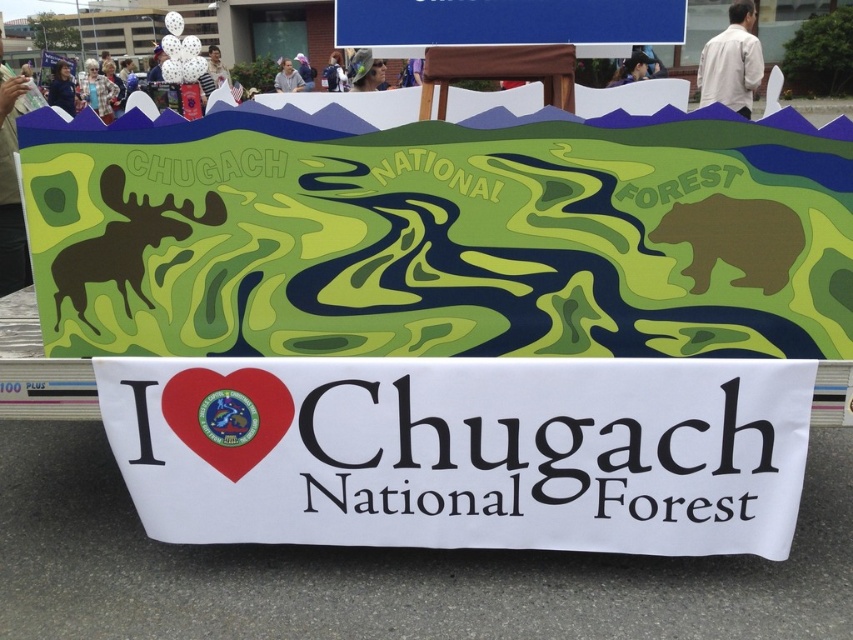
Question: Is matte black shirt at upper left positioned at the back of matte black backpack at center?

Choices:
 (A) no
 (B) yes

Answer: (A)

Question: Which of the following is the closest to the observer?

Choices:
 (A) (x=230, y=84)
 (B) (x=86, y=300)
 (C) (x=341, y=84)
 (D) (x=637, y=461)

Answer: (D)

Question: Can you confirm if black matte moose at left is positioned to the right of matte white shirt at upper center?

Choices:
 (A) no
 (B) yes

Answer: (B)

Question: Which point appears farthest from the camera in this image?

Choices:
 (A) (97, 77)
 (B) (294, 84)
 (C) (312, 72)
 (D) (57, 314)

Answer: (C)

Question: Which point appears farthest from the camera in this image?

Choices:
 (A) (665, 218)
 (B) (370, 67)
 (C) (281, 84)
 (D) (215, 216)

Answer: (C)

Question: Does black matte moose at left have a lesser width compared to matte black backpack at upper center?

Choices:
 (A) yes
 (B) no

Answer: (B)